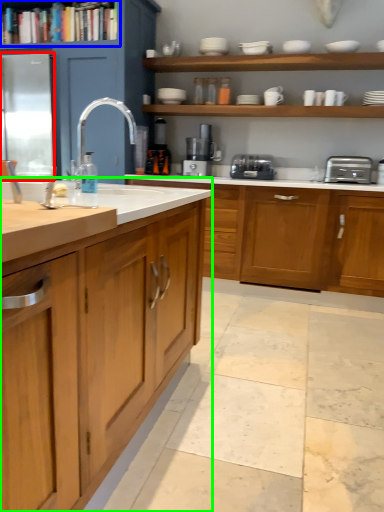
Question: Estimate the real-world distances between objects in this image. Which object is farther from glass door (highlighted by a red box), shelf (highlighted by a blue box) or countertop (highlighted by a green box)?

Choices:
 (A) shelf
 (B) countertop

Answer: (B)